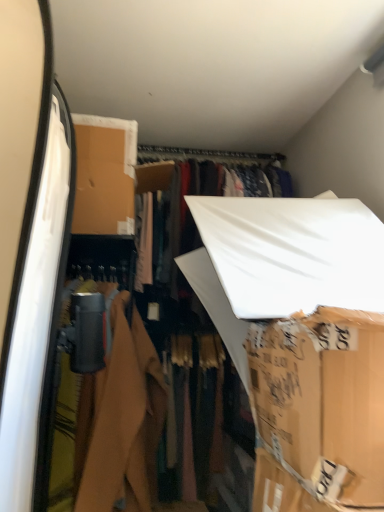
Question: Is brown cardboard box at center far away from matte black camera at left?

Choices:
 (A) yes
 (B) no

Answer: (B)

Question: Is brown cardboard box at center shorter than matte black camera at left?

Choices:
 (A) no
 (B) yes

Answer: (B)

Question: Is brown cardboard box at center thinner than matte black camera at left?

Choices:
 (A) yes
 (B) no

Answer: (A)

Question: Is brown cardboard box at center to the left of matte black camera at left from the viewer's perspective?

Choices:
 (A) no
 (B) yes

Answer: (A)

Question: From the image's perspective, would you say brown cardboard box at center is positioned over matte black camera at left?

Choices:
 (A) yes
 (B) no

Answer: (A)

Question: Is brown cardboard box at center positioned with its back to matte black camera at left?

Choices:
 (A) no
 (B) yes

Answer: (A)

Question: Can you confirm if matte black camera at left is bigger than brown cardboard box at center?

Choices:
 (A) no
 (B) yes

Answer: (B)

Question: Does matte black camera at left appear on the left side of brown cardboard box at center?

Choices:
 (A) yes
 (B) no

Answer: (A)

Question: Is matte black camera at left not near brown cardboard box at center?

Choices:
 (A) yes
 (B) no

Answer: (B)

Question: From a real-world perspective, is matte black camera at left beneath brown cardboard box at center?

Choices:
 (A) no
 (B) yes

Answer: (B)

Question: Is matte black camera at left thinner than brown cardboard box at center?

Choices:
 (A) yes
 (B) no

Answer: (B)

Question: From the image's perspective, would you say matte black camera at left is positioned over brown cardboard box at center?

Choices:
 (A) no
 (B) yes

Answer: (A)

Question: Is brown cardboard box at center inside the boundaries of matte black camera at left, or outside?

Choices:
 (A) inside
 (B) outside

Answer: (B)